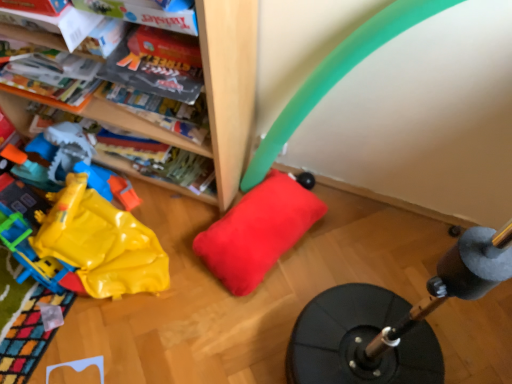
Question: Is red plush pillow at center shorter than rubber/yellow at left?

Choices:
 (A) no
 (B) yes

Answer: (B)

Question: From a real-world perspective, is red plush pillow at center located beneath rubber/yellow at left?

Choices:
 (A) no
 (B) yes

Answer: (B)

Question: Is red plush pillow at center closer to the viewer compared to rubber/yellow at left?

Choices:
 (A) yes
 (B) no

Answer: (B)

Question: Does red plush pillow at center have a greater width compared to rubber/yellow at left?

Choices:
 (A) no
 (B) yes

Answer: (A)

Question: Is red plush pillow at center further to camera compared to rubber/yellow at left?

Choices:
 (A) yes
 (B) no

Answer: (A)

Question: Is red plush pillow at center in contact with rubber/yellow at left?

Choices:
 (A) no
 (B) yes

Answer: (A)

Question: Considering the relative sizes of rubber/yellow at left and red plush pillow at center in the image provided, is rubber/yellow at left smaller than red plush pillow at center?

Choices:
 (A) no
 (B) yes

Answer: (A)

Question: Does rubber/yellow at left have a lesser height compared to red plush pillow at center?

Choices:
 (A) no
 (B) yes

Answer: (A)

Question: Is the position of rubber/yellow at left more distant than that of red plush pillow at center?

Choices:
 (A) yes
 (B) no

Answer: (B)

Question: From a real-world perspective, is rubber/yellow at left on red plush pillow at center?

Choices:
 (A) yes
 (B) no

Answer: (A)

Question: Are rubber/yellow at left and red plush pillow at center located far from each other?

Choices:
 (A) yes
 (B) no

Answer: (B)

Question: From the image's perspective, does rubber/yellow at left appear higher than red plush pillow at center?

Choices:
 (A) yes
 (B) no

Answer: (A)

Question: From the image's perspective, relative to red plush pillow at center, is rubber/yellow at left above or below?

Choices:
 (A) above
 (B) below

Answer: (A)